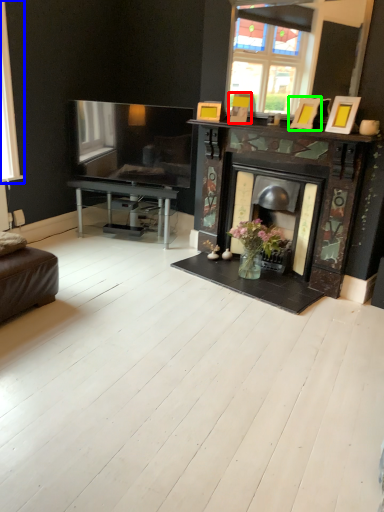
Question: Estimate the real-world distances between objects in this image. Which object is farther from picture frame (highlighted by a red box), window (highlighted by a blue box) or picture frame (highlighted by a green box)?

Choices:
 (A) window
 (B) picture frame

Answer: (A)